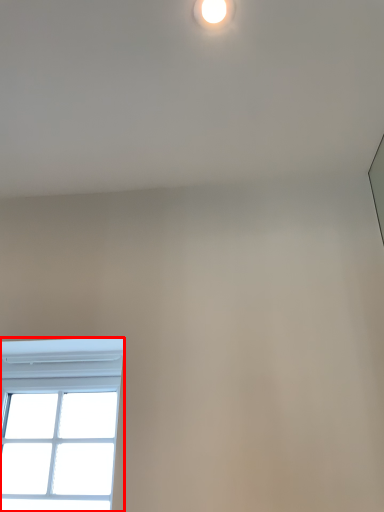
Question: From the image, what is the correct spatial relationship of window (annotated by the red box) in relation to droplight?

Choices:
 (A) right
 (B) left

Answer: (B)